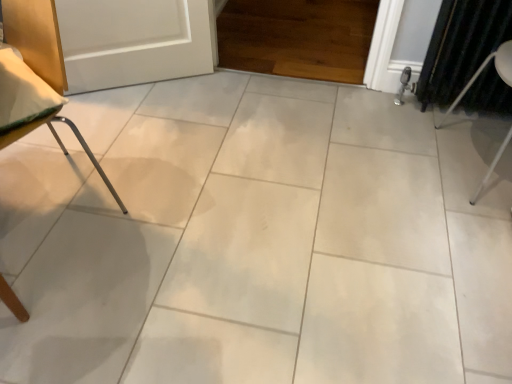
This screenshot has width=512, height=384. I want to click on free space in front of metallic silver chair leg at left, positioned as the second furniture in right-to-left order, so click(x=73, y=309).